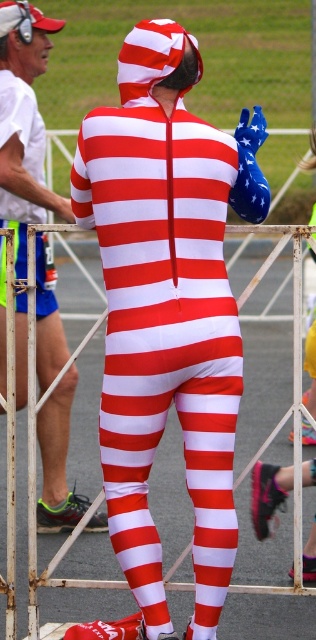
Question: Is matte red-white striped suit at center to the right of smooth asphalt race track at center from the viewer's perspective?

Choices:
 (A) yes
 (B) no

Answer: (B)

Question: Estimate the real-world distances between objects in this image. Which object is farther from the matte red and white striped suit at center?

Choices:
 (A) matte red-white striped suit at center
 (B) smooth asphalt race track at center

Answer: (A)

Question: Which point is farther from the camera taking this photo?

Choices:
 (A) (272, 227)
 (B) (24, 97)
 (C) (116, 80)

Answer: (C)

Question: Where is matte red and white striped suit at center located in relation to matte red-white striped suit at center in the image?

Choices:
 (A) right
 (B) left

Answer: (A)

Question: Estimate the real-world distances between objects in this image. Which object is farther from the smooth asphalt race track at center?

Choices:
 (A) matte red and white striped suit at center
 (B) matte red-white striped suit at center

Answer: (B)

Question: Is matte red and white striped suit at center to the right of matte red-white striped suit at center from the viewer's perspective?

Choices:
 (A) yes
 (B) no

Answer: (A)